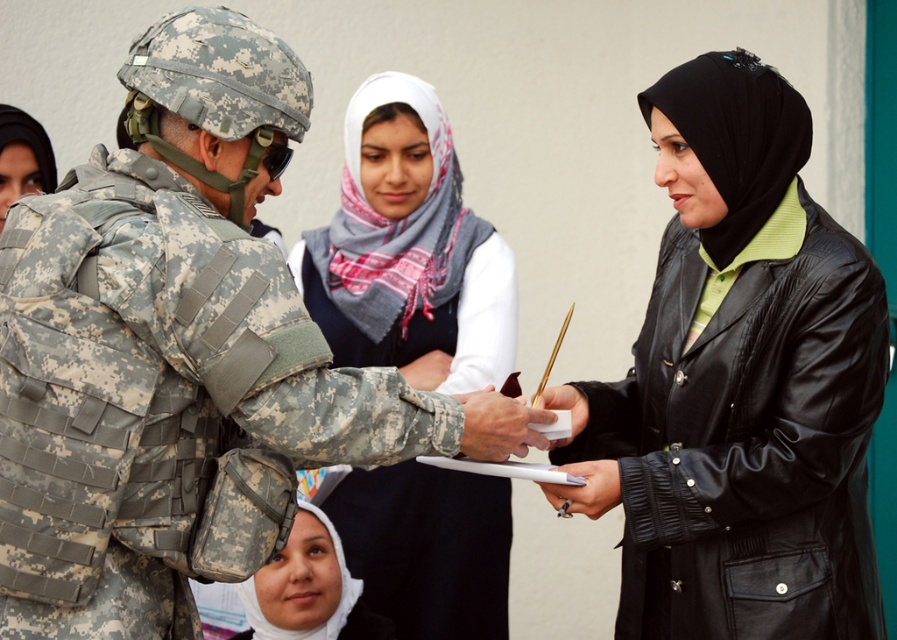
Based on the scene, can you determine the spatial relationship between the camouflage uniform at center and the white matte hijab at lower center?

The camouflage uniform at center is above the white matte hijab at lower center.

You are a photographer standing at the point marked as point (308, 589). You want to capture a photo of the white matte hijab at lower center. Is the white matte hijab at lower center visible from your current position?

Yes, the white matte hijab at lower center is located exactly at the point you are standing, so it should be clearly visible from your current position.